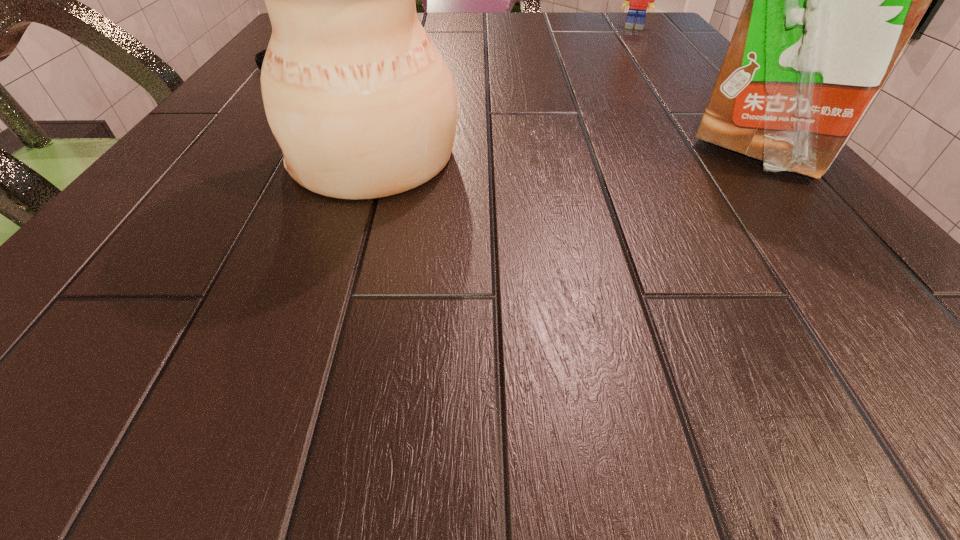
The width and height of the screenshot is (960, 540). In order to click on blank area located on the display of the third nearest object in this screenshot , I will do `click(410, 98)`.

This screenshot has height=540, width=960. I want to click on vacant space situated 0.090m on the display of the third nearest object, so coord(346,82).

This screenshot has width=960, height=540. In order to click on vacant region located 0.210m on the front-facing side of the Lego in this screenshot , I will do `click(627, 63)`.

Find the location of a particular element. The height and width of the screenshot is (540, 960). vacant space situated 0.340m on the front-facing side of the Lego is located at coordinates (623, 89).

In order to click on free spot located 0.050m on the front-facing side of the Lego in this screenshot , I will do `click(631, 37)`.

The width and height of the screenshot is (960, 540). I want to click on object at the far edge, so click(x=639, y=0).

The width and height of the screenshot is (960, 540). Identify the location of object situated at the left edge. (259, 57).

In order to click on carton that is at the right edge in this screenshot , I will do `click(831, 1)`.

Locate an element on the screen. The height and width of the screenshot is (540, 960). Lego that is at the right edge is located at coordinates (639, 0).

You are a GUI agent. You are given a task and a screenshot of the screen. Output one action in this format:
    pyautogui.click(x=<x>, y=<y>)
    Task: Click on the object situated at the far right corner
    The width and height of the screenshot is (960, 540).
    Given the screenshot: What is the action you would take?
    pyautogui.click(x=639, y=0)